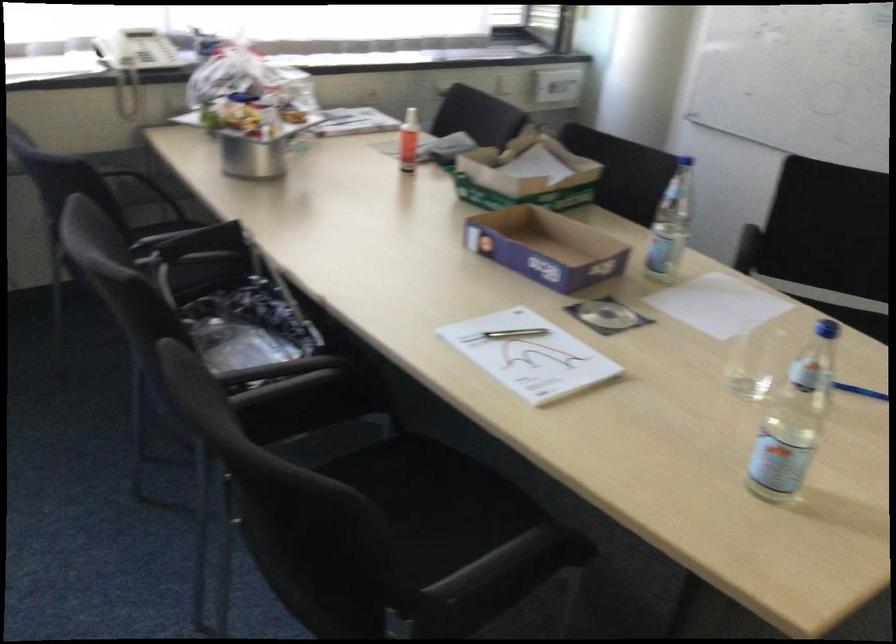
Where would you push the red spray bottle? Please return your answer as a coordinate pair (x, y).

(409, 140)